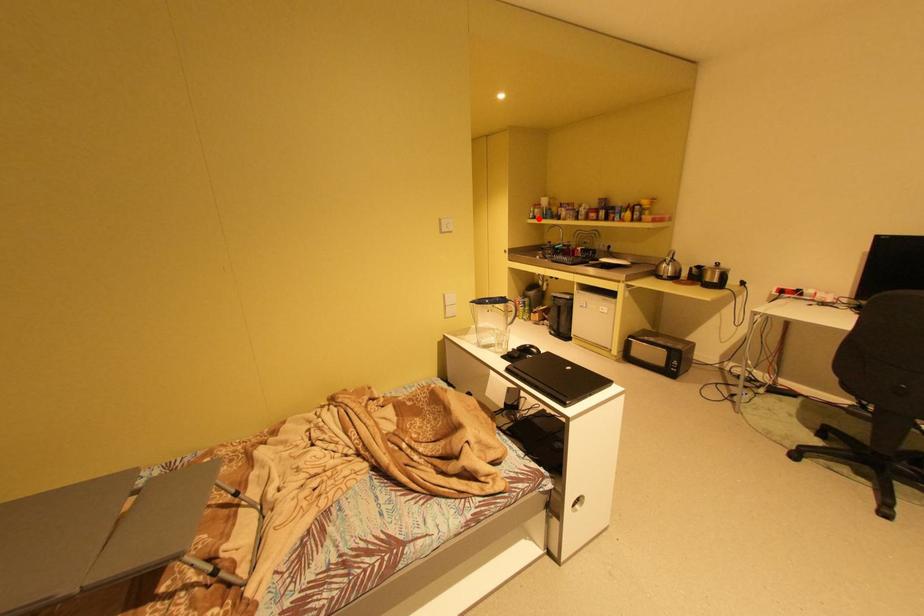
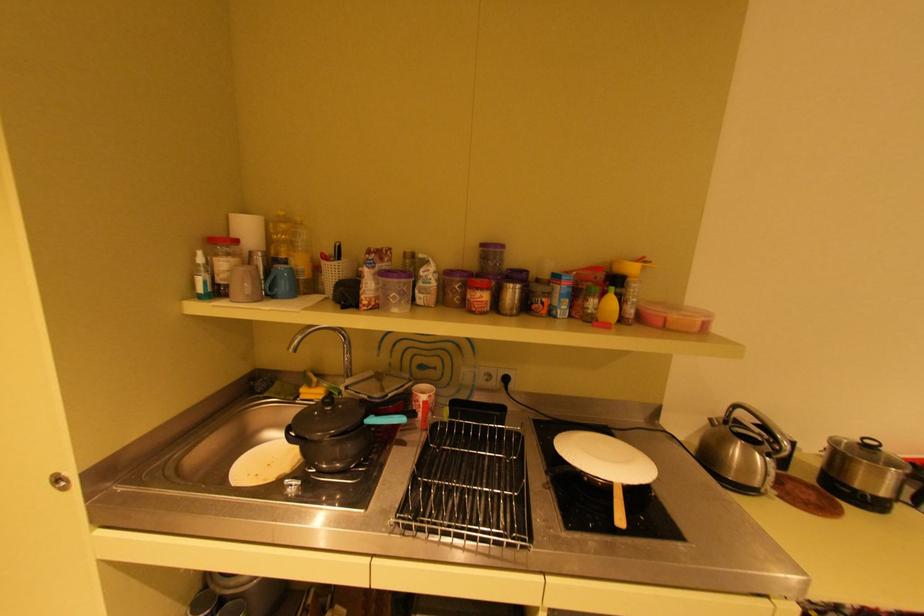
Locate, in the second image, the point that corresponds to the highlighted location in the first image.

(208, 297)